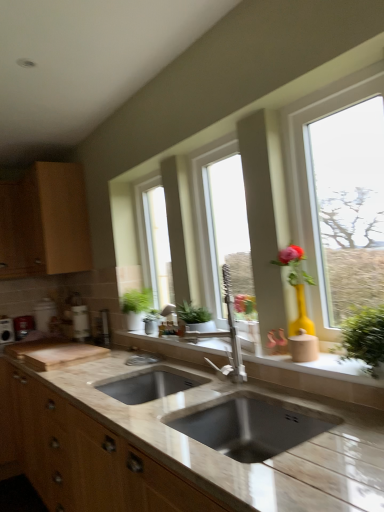
Where is `free point above yellow matte vase at right, positioned as the third window in back-to-front order (from a real-world perspective)`? The image size is (384, 512). free point above yellow matte vase at right, positioned as the third window in back-to-front order (from a real-world perspective) is located at coordinates (326, 87).